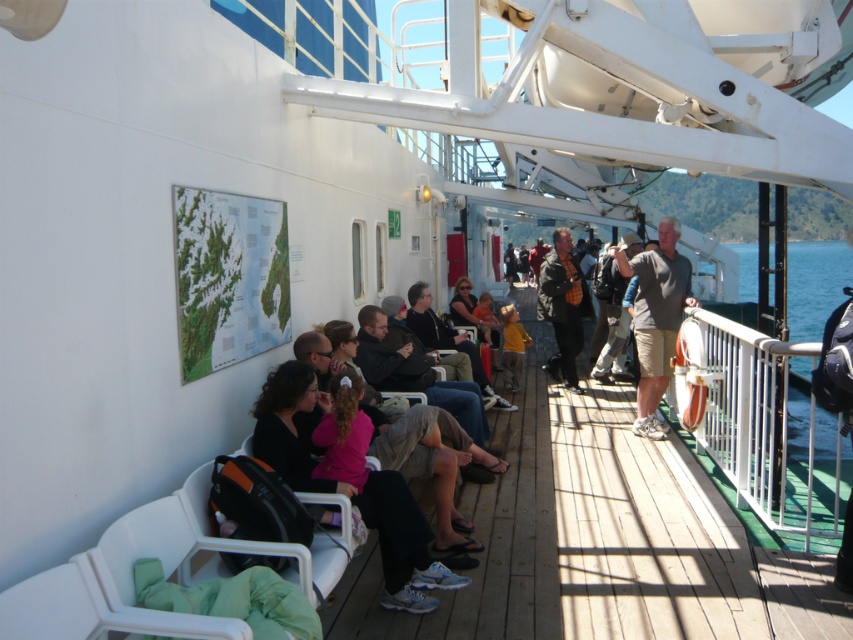
Which is more to the left, gray cotton t-shirt at center or matte black jacket at center?

matte black jacket at center

Between gray cotton t-shirt at center and matte black jacket at center, which one has more height?

With more height is gray cotton t-shirt at center.

The width and height of the screenshot is (853, 640). In order to click on gray cotton t-shirt at center in this screenshot , I will do `click(656, 317)`.